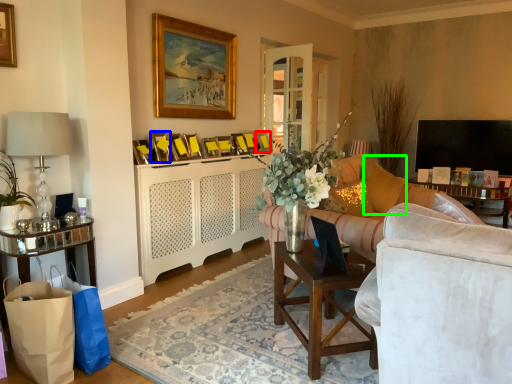
Question: Based on their relative distances, which object is nearer to picture frame (highlighted by a red box)? Choose from picture frame (highlighted by a blue box) and pillow (highlighted by a green box).

Choices:
 (A) picture frame
 (B) pillow

Answer: (B)